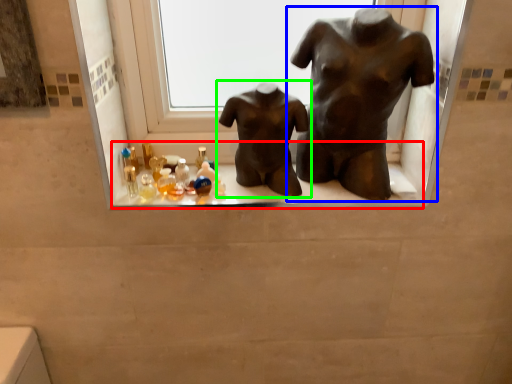
Question: Estimate the real-world distances between objects in this image. Which object is farther from window sill (highlighted by a red box), statue (sculpture) (highlighted by a blue box) or statue (sculpture) (highlighted by a green box)?

Choices:
 (A) statue (sculpture)
 (B) statue (sculpture)

Answer: (A)